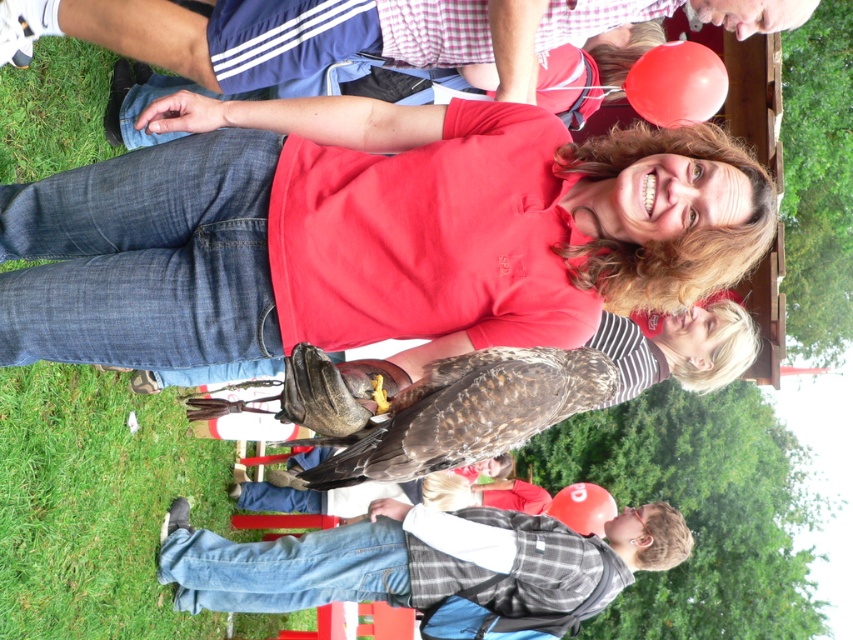
You are a photographer trying to capture the matte brown bird at center and the denim jeans at lower left in the same frame. Which object should you focus on first if you want to ensure both are in focus, considering their sizes?

The denim jeans at lower left is larger than the matte brown bird at center, so focusing on the denim jeans at lower left first would help ensure both are in focus since larger objects often require more precise focus adjustments.

Consider the image. You are a photographer trying to capture the bird of prey in the scene. The bird is located at point (368,232). Where should you aim your camera to ensure the bird is centered in the frame?

You should aim your camera at the point (368,232) to center the matte brown bird at center in the frame.

You are a photographer trying to capture a clear shot of the brown feathered falcon at center without including the denim jeans at lower left in the frame. Given the spatial relationship between them, is this possible?

The denim jeans at lower left are wider than the brown feathered falcon at center. Therefore, it might be challenging to frame the falcon without including the jeans since the jeans are wider and positioned lower in the scene.